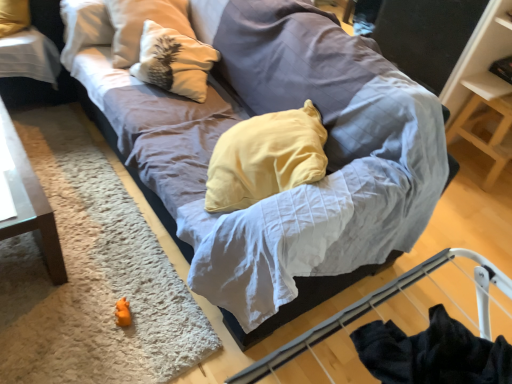
Question: Does white textured pillow at upper left come in front of wooden shelf at upper right?

Choices:
 (A) no
 (B) yes

Answer: (B)

Question: Is white textured pillow at upper left oriented towards wooden shelf at upper right?

Choices:
 (A) no
 (B) yes

Answer: (A)

Question: From the image's perspective, is white textured pillow at upper left on wooden shelf at upper right?

Choices:
 (A) no
 (B) yes

Answer: (B)

Question: Considering the relative sizes of white textured pillow at upper left and wooden shelf at upper right in the image provided, is white textured pillow at upper left shorter than wooden shelf at upper right?

Choices:
 (A) yes
 (B) no

Answer: (A)

Question: Does white textured pillow at upper left lie behind wooden shelf at upper right?

Choices:
 (A) yes
 (B) no

Answer: (B)

Question: Is orange plush toy at lower left taller or shorter than textured gray couch at center?

Choices:
 (A) tall
 (B) short

Answer: (B)

Question: Is point (121, 314) positioned closer to the camera than point (164, 115)?

Choices:
 (A) closer
 (B) farther

Answer: (A)

Question: Choose the correct answer: Is orange plush toy at lower left inside textured gray couch at center or outside it?

Choices:
 (A) outside
 (B) inside

Answer: (A)

Question: Relative to textured gray couch at center, is orange plush toy at lower left in front or behind?

Choices:
 (A) behind
 (B) front

Answer: (A)

Question: Visually, is orange plush toy at lower left positioned to the left or to the right of white shaggy rug at lower left?

Choices:
 (A) left
 (B) right

Answer: (B)

Question: Is orange plush toy at lower left in front of or behind white shaggy rug at lower left in the image?

Choices:
 (A) behind
 (B) front

Answer: (A)

Question: Is point [118, 322] positioned closer to the camera than point [111, 213]?

Choices:
 (A) farther
 (B) closer

Answer: (B)

Question: From the image's perspective, is orange plush toy at lower left located above or below white shaggy rug at lower left?

Choices:
 (A) below
 (B) above

Answer: (A)

Question: From a real-world perspective, is black glossy table at upper left positioned above or below textured gray couch at center?

Choices:
 (A) below
 (B) above

Answer: (A)

Question: From the image's perspective, is black glossy table at upper left positioned above or below textured gray couch at center?

Choices:
 (A) above
 (B) below

Answer: (A)